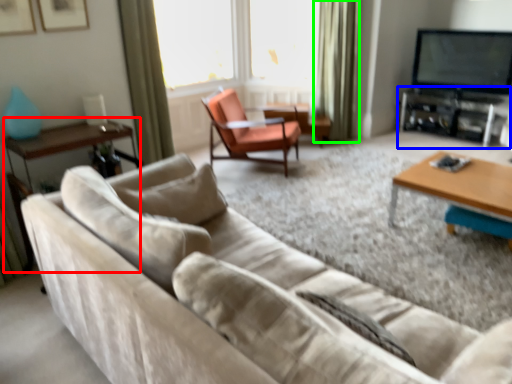
Question: Based on their relative distances, which object is nearer to side table (highlighted by a red box)? Choose from entertainment center (highlighted by a blue box) and curtain (highlighted by a green box).

Choices:
 (A) entertainment center
 (B) curtain

Answer: (B)